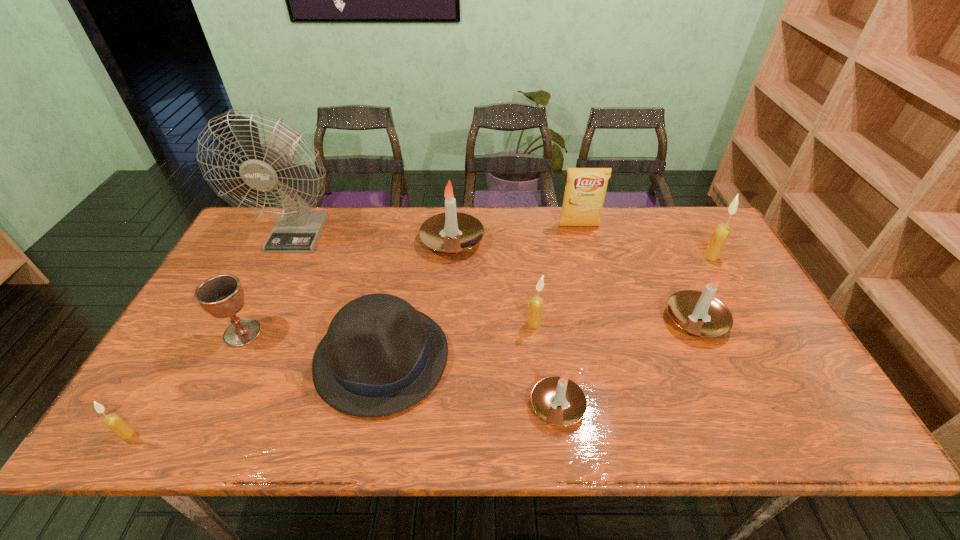
Locate an element on the screen. the second smallest white candle is located at coordinates (699, 313).

Identify the location of brown chalice. The image size is (960, 540). (222, 296).

Where is `bowler hat`? This screenshot has height=540, width=960. bowler hat is located at coordinates (380, 356).

The width and height of the screenshot is (960, 540). I want to click on the nearest white candle, so click(x=557, y=400).

At what (x,y) coordinates should I click in order to perform the action: click on the second white candle from right to left. Please return your answer as a coordinate pair (x, y). The image size is (960, 540). Looking at the image, I should click on (557, 400).

You are a GUI agent. You are given a task and a screenshot of the screen. Output one action in this format:
    pyautogui.click(x=<x>, y=<y>)
    Task: Click on the nearest cream candle
    This screenshot has height=540, width=960.
    Given the screenshot: What is the action you would take?
    pyautogui.click(x=114, y=422)

I want to click on the leftmost candle, so click(x=114, y=422).

Locate an element on the screen. vacant space located on the air flow direction of the tallest object is located at coordinates (249, 335).

Image resolution: width=960 pixels, height=540 pixels. What are the coordinates of `free point located 0.100m on the right of the leftmost white candle` in the screenshot? It's located at (516, 241).

What are the coordinates of `vacant region located 0.080m on the left of the rightmost cream candle` in the screenshot? It's located at (678, 256).